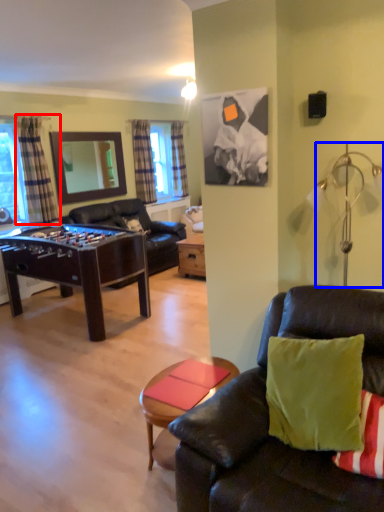
Question: Which point is closer to the camera, curtain (highlighted by a red box) or lamp (highlighted by a blue box)?

Choices:
 (A) curtain
 (B) lamp

Answer: (B)